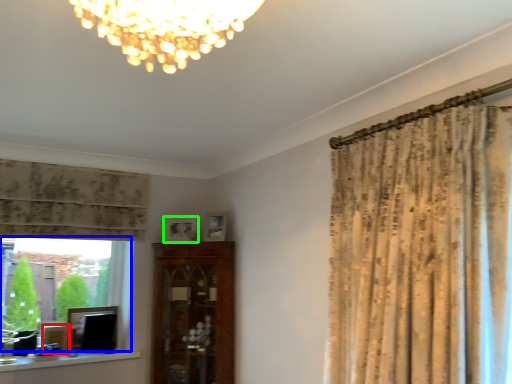
Question: Estimate the real-world distances between objects in this image. Which object is farther from picture frame (highlighted by a red box), bay window (highlighted by a blue box) or picture frame (highlighted by a green box)?

Choices:
 (A) bay window
 (B) picture frame

Answer: (B)